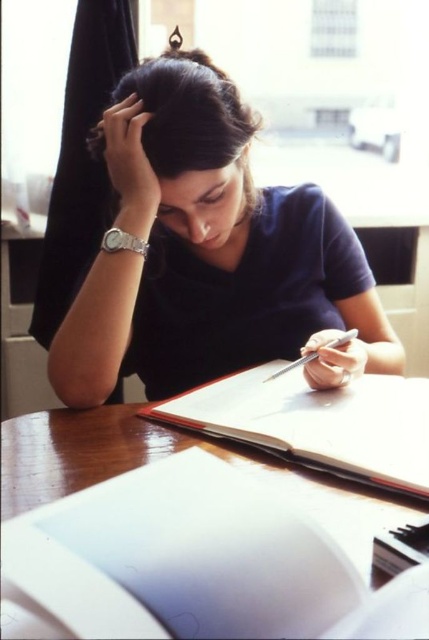
You are a person who wants to place a new notebook on the table without covering the existing notebook at point (317, 422). Where should you place the new notebook?

The existing notebook is located at point (317, 422), so you should place the new notebook in an area of the table that does not overlap with this coordinate to avoid covering it.

You are standing in front of the wooden table where the person is sitting. You want to place a 12 inch wide gift box on the table between you and the dark blue shirt at center. Is there enough space for the gift box?

The distance between you and the dark blue shirt at center is 28.41 inches. Since the gift box is 12 inches wide, there is enough space to place it between you and the dark blue shirt at center.